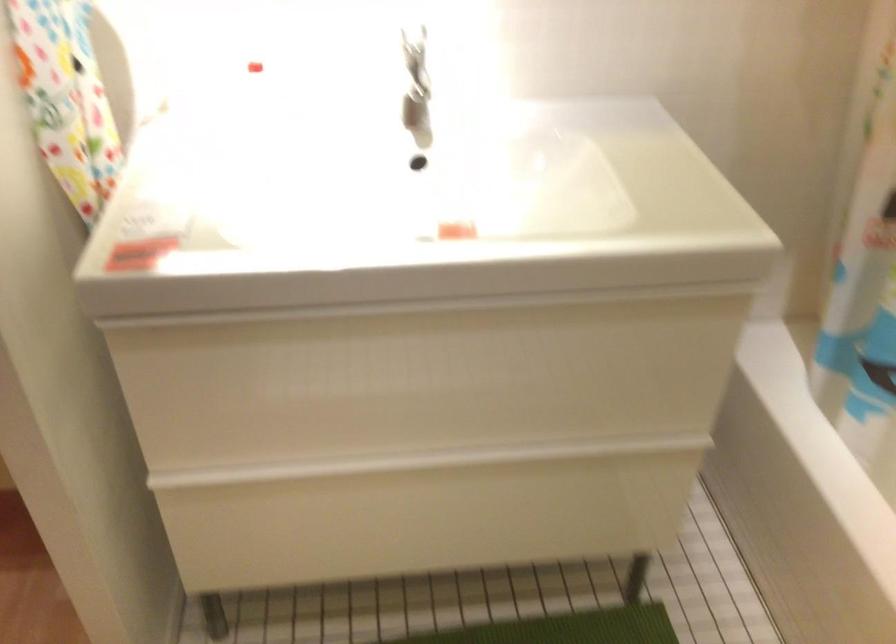
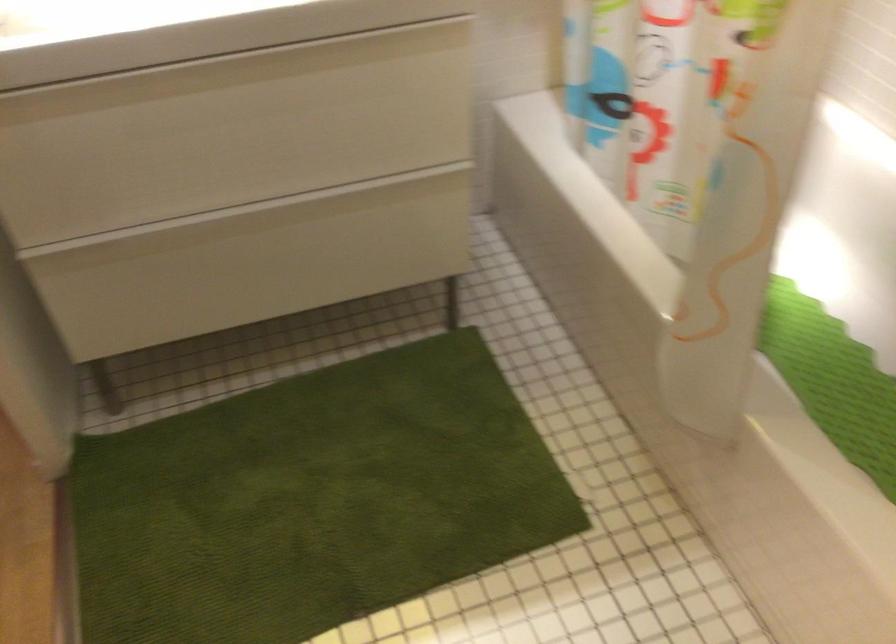
Question: In a continuous first-person perspective shot, in which direction is the camera moving?

Choices:
 (A) Left
 (B) Right
 (C) Forward
 (D) Backward

Answer: (D)